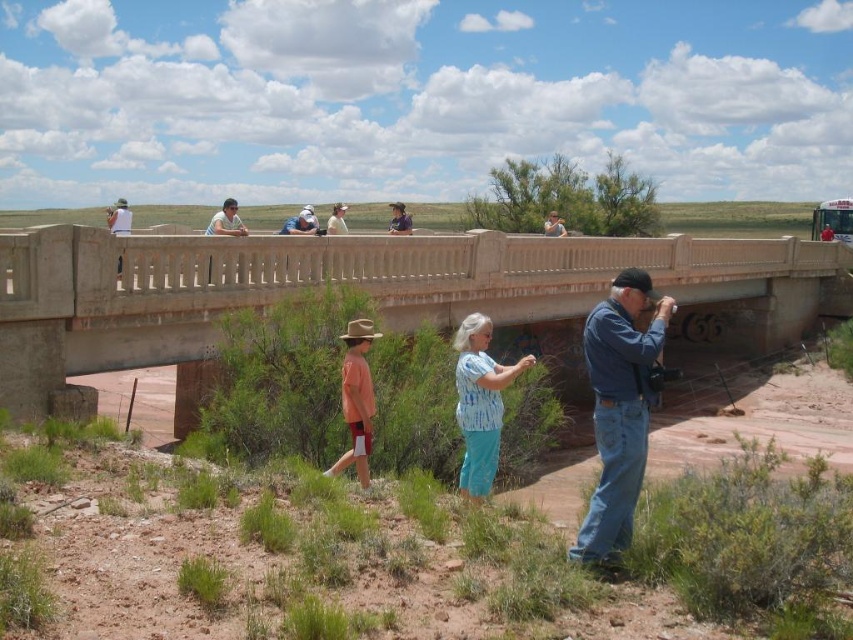
Is blue denim jeans at lower right in front of matte orange shirt at center?

Yes, blue denim jeans at lower right is closer to the viewer.

In the scene shown: Is blue denim jeans at lower right positioned at the back of matte orange shirt at center?

No, it is not.

What do you see at coordinates (619, 410) in the screenshot?
I see `blue denim jeans at lower right` at bounding box center [619, 410].

At what (x,y) coordinates should I click in order to perform the action: click on blue denim jeans at lower right. Please return your answer as a coordinate pair (x, y). Looking at the image, I should click on pyautogui.click(x=619, y=410).

Describe the element at coordinates (363, 289) in the screenshot. I see `concrete bridge at center` at that location.

Does concrete bridge at center have a smaller size compared to matte orange shirt at center?

No, concrete bridge at center is not smaller than matte orange shirt at center.

Between point (558, 256) and point (364, 376), which one is positioned behind?

The point (558, 256) is behind.

I want to click on concrete bridge at center, so click(x=363, y=289).

Can you confirm if concrete bridge at center is shorter than blue tie-dye shirt at center?

In fact, concrete bridge at center may be taller than blue tie-dye shirt at center.

Who is more forward, (703, 300) or (471, 356)?

Point (471, 356) is more forward.

Is point (763, 330) less distant than point (495, 452)?

No, it is not.

You are a GUI agent. You are given a task and a screenshot of the screen. Output one action in this format:
    pyautogui.click(x=<x>, y=<y>)
    Task: Click on the concrete bridge at center
    The width and height of the screenshot is (853, 640).
    Given the screenshot: What is the action you would take?
    pyautogui.click(x=363, y=289)